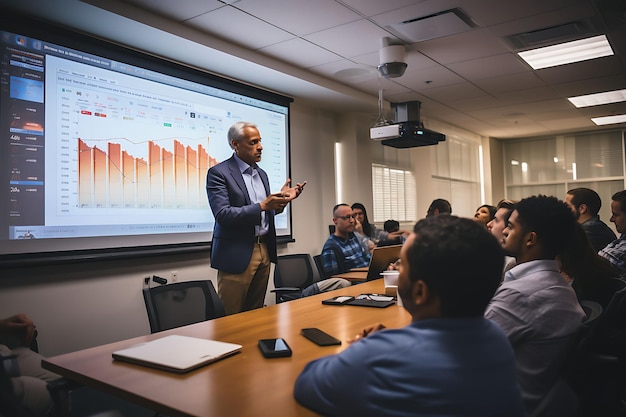
You are a GUI agent. You are given a task and a screenshot of the screen. Output one action in this format:
    pyautogui.click(x=<x>, y=<y>)
    Task: Click on the windows
    
    Given the screenshot: What is the action you would take?
    pyautogui.click(x=407, y=198), pyautogui.click(x=387, y=160), pyautogui.click(x=466, y=147), pyautogui.click(x=471, y=201), pyautogui.click(x=441, y=187), pyautogui.click(x=444, y=162)